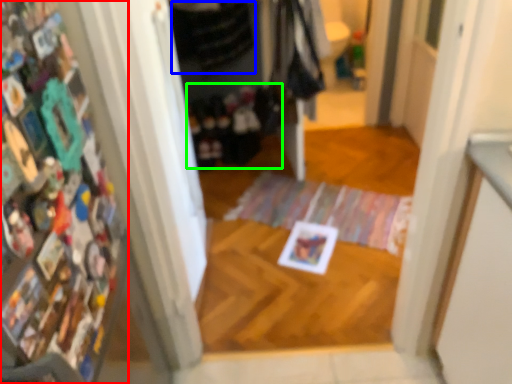
Question: Based on their relative distances, which object is nearer to book (highlighted by a red box)? Choose from clothing (highlighted by a blue box) and clothing (highlighted by a green box).

Choices:
 (A) clothing
 (B) clothing

Answer: (A)